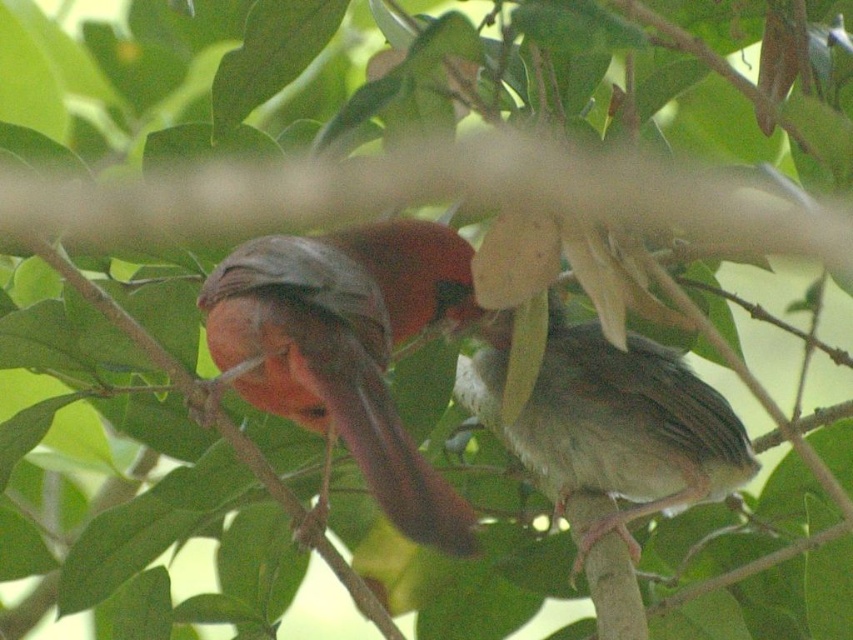
Looking at this image, is matte orange bird at center smaller than gray matte bird at center?

No, matte orange bird at center is not smaller than gray matte bird at center.

Between matte orange bird at center and gray matte bird at center, which one is positioned higher?

matte orange bird at center is higher up.

Where is `matte orange bird at center`? The image size is (853, 640). matte orange bird at center is located at coordinates (346, 348).